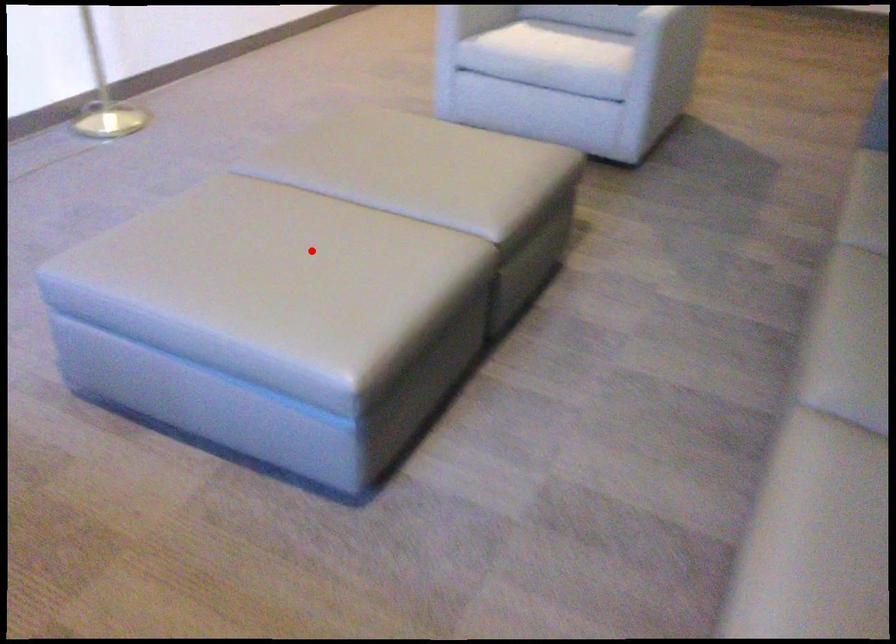
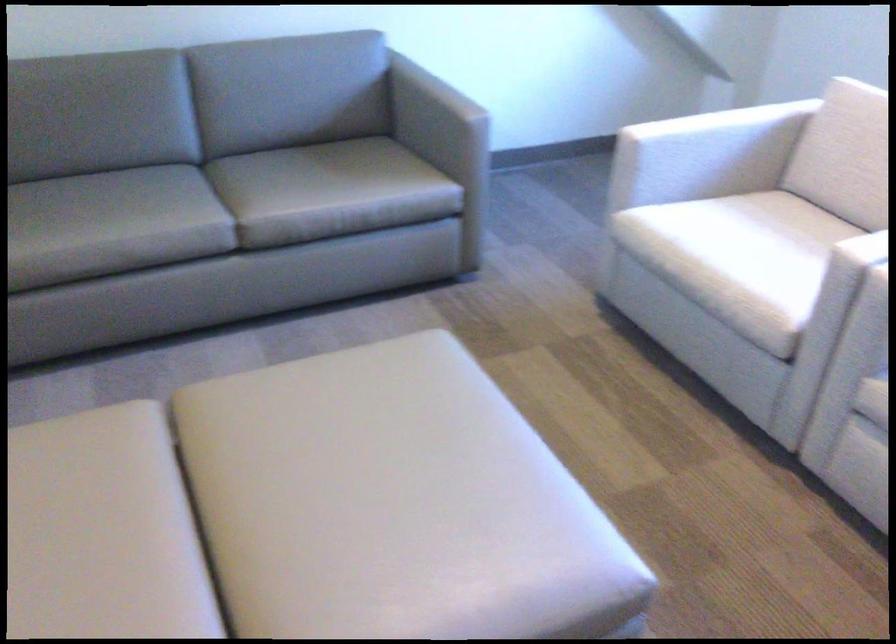
Locate, in the second image, the point that corresponds to the highlighted location in the first image.

(348, 446)